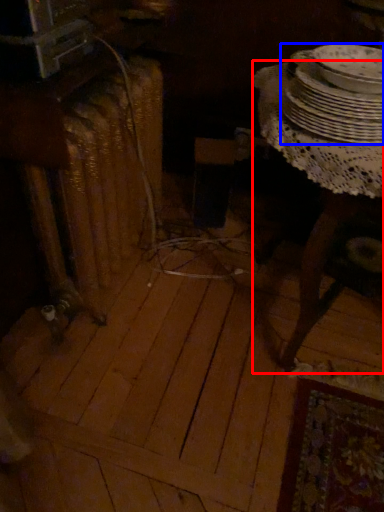
Question: Which point is closer to the camera, table (highlighted by a red box) or tableware (highlighted by a blue box)?

Choices:
 (A) table
 (B) tableware

Answer: (A)